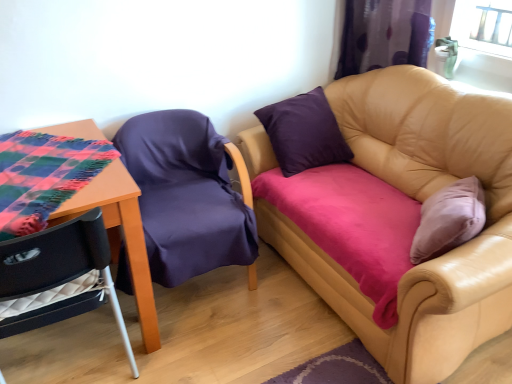
Question: In terms of width, does velvet purple chair at lower left, which ranks as the 1th chair in left-to-right order, look wider or thinner when compared to purple fabric curtain at upper right?

Choices:
 (A) wide
 (B) thin

Answer: (A)

Question: Which is correct: velvet purple chair at lower left, arranged as the 2th chair when viewed from the right, is inside purple fabric curtain at upper right, or outside of it?

Choices:
 (A) outside
 (B) inside

Answer: (A)

Question: Estimate the real-world distances between objects in this image. Which object is closer to the velvet purple chair at lower left, arranged as the 2th chair when viewed from the right?

Choices:
 (A) plaid fabric-covered table at left
 (B) tan leather couch at upper right
 (C) purple fabric curtain at upper right
 (D) purple fabric chair at left, the second chair in the left-to-right sequence

Answer: (A)

Question: Which object is the closest to the plaid fabric-covered table at left?

Choices:
 (A) purple fabric chair at left, the first chair viewed from the right
 (B) purple fabric curtain at upper right
 (C) tan leather couch at upper right
 (D) velvet purple chair at lower left, which ranks as the 1th chair in left-to-right order

Answer: (D)